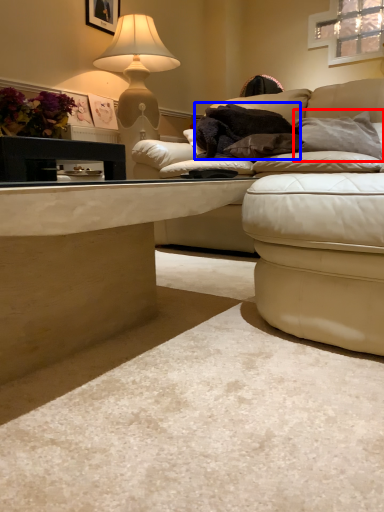
Question: Which point is closer to the camera, pillow (highlighted by a red box) or blanket (highlighted by a blue box)?

Choices:
 (A) pillow
 (B) blanket

Answer: (A)